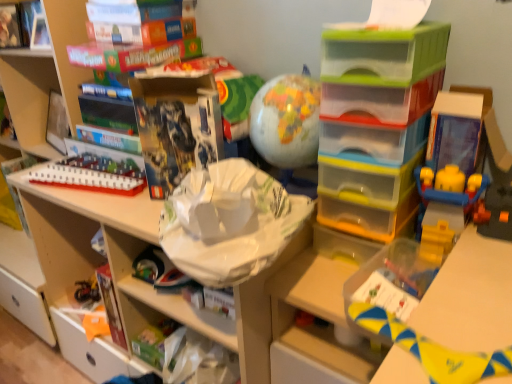
What are the coordinates of `free location to the left of matte black book at upper center, acting as the fifth book starting from the left` in the screenshot? It's located at (118, 203).